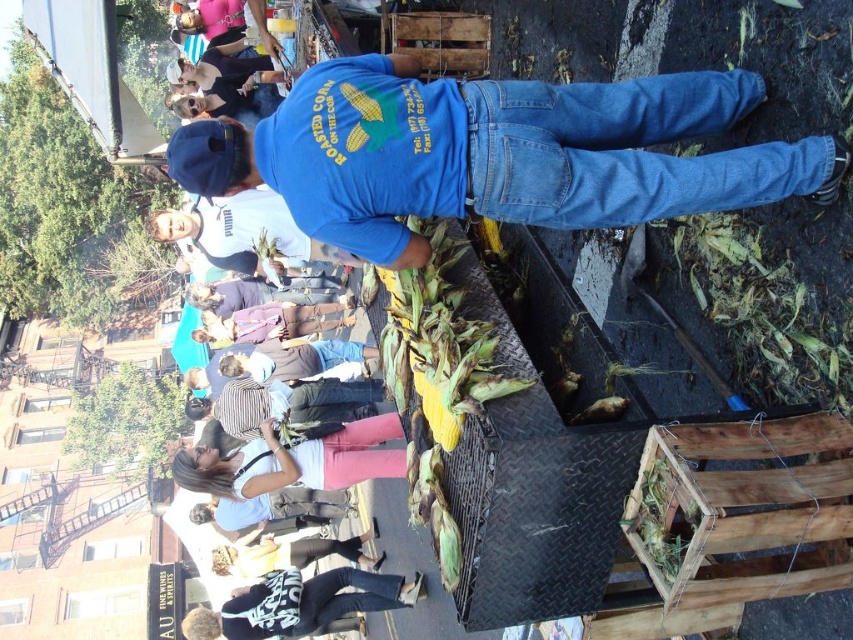
Is black and white printed shirt at lower center above denim jacket at lower center?

Actually, black and white printed shirt at lower center is below denim jacket at lower center.

Image resolution: width=853 pixels, height=640 pixels. What do you see at coordinates (302, 604) in the screenshot?
I see `black and white printed shirt at lower center` at bounding box center [302, 604].

In order to click on black and white printed shirt at lower center in this screenshot , I will do `click(302, 604)`.

Does blue denim jeans at center have a smaller size compared to denim jacket at lower center?

Yes, blue denim jeans at center is smaller than denim jacket at lower center.

Does blue denim jeans at center lie behind denim jacket at lower center?

No, it is not.

Locate an element on the screen. The width and height of the screenshot is (853, 640). blue denim jeans at center is located at coordinates (494, 152).

Is blue denim jeans at center above denim pants at lower center?

Indeed, blue denim jeans at center is positioned over denim pants at lower center.

Based on the photo, is blue denim jeans at center positioned at the back of denim pants at lower center?

No, it is not.

Identify the location of blue denim jeans at center. (494, 152).